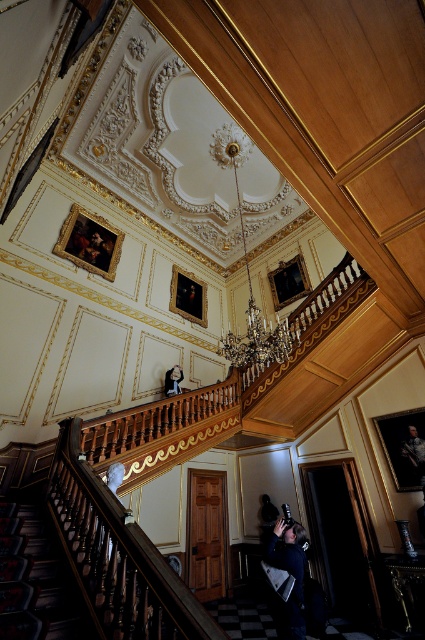
Question: Can you confirm if dark wood stairwell at lower left is positioned to the left of smooth white statue at center?

Choices:
 (A) no
 (B) yes

Answer: (B)

Question: Which object is farther from the camera taking this photo?

Choices:
 (A) dark wood stairwell at lower left
 (B) smooth white statue at center

Answer: (B)

Question: Is dark wood stairwell at lower left to the right of smooth white statue at center from the viewer's perspective?

Choices:
 (A) no
 (B) yes

Answer: (A)

Question: Does dark wood stairwell at lower left appear on the left side of smooth white statue at center?

Choices:
 (A) yes
 (B) no

Answer: (A)

Question: Which point appears closest to the camera in this image?

Choices:
 (A) (170, 392)
 (B) (25, 634)

Answer: (B)